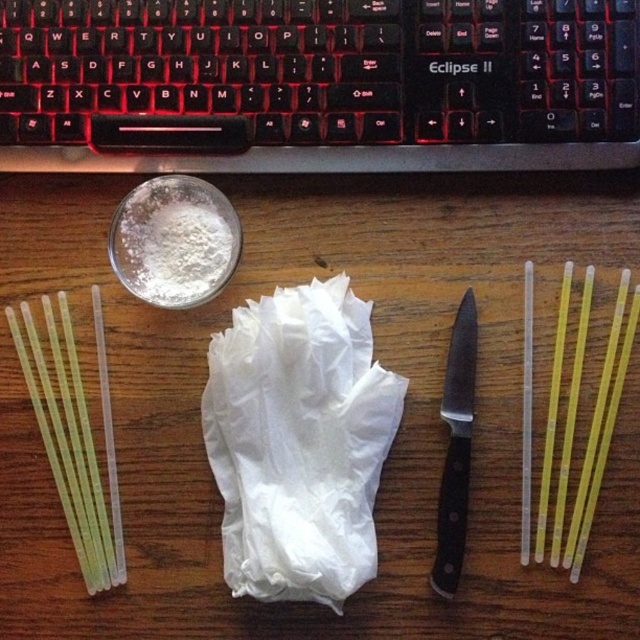
You are organizing items on a desk and need to place a new object between the black plastic knife at center and the yellow translucent straw at right. Which item should be placed closer to you to maintain the existing spatial arrangement?

The black plastic knife at center is closer to you than the yellow translucent straw at right, so place the new object closer to the black plastic knife at center to maintain the existing spatial arrangement.

From the picture: You are organizing items on a desk and need to place the black plastic knife at center and the yellow translucent straw at right into a drawer. The drawer has a height limit of 12 cm. Can both items fit vertically without bending?

The black plastic knife at center is much taller than the yellow translucent straw at right. Since the drawer has a 12 cm height limit, the knife may not fit vertically if its height exceeds 12 cm, while the straw would likely fit. However, without knowing the exact height of the knife, we cannot confirm if both can fit.

You are organizing items on a desk and need to place a new item between the white matte plastic bag at center and the black plastic knife at center. Given that the space between them is 6.72 inches, can you fit a 6.5 inch wide book horizontally between them?

The space between the white matte plastic bag at center and the black plastic knife at center is 6.72 inches, so yes, a 6.5 inch wide book can fit horizontally between them since it is narrower than the available space.